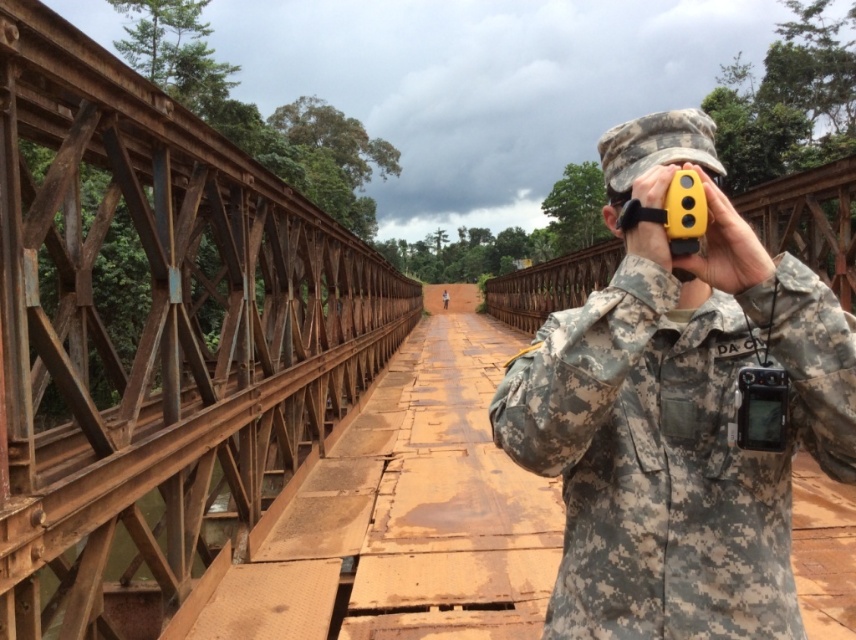
Who is positioned more to the left, rusty metal bridge at left or camouflage fabric binoculars at center?

From the viewer's perspective, rusty metal bridge at left appears more on the left side.

Does rusty metal bridge at left have a lesser height compared to camouflage fabric binoculars at center?

No.

Is point (223, 202) positioned in front of point (574, 636)?

No, (223, 202) is behind (574, 636).

Locate an element on the screen. This screenshot has width=856, height=640. rusty metal bridge at left is located at coordinates (153, 337).